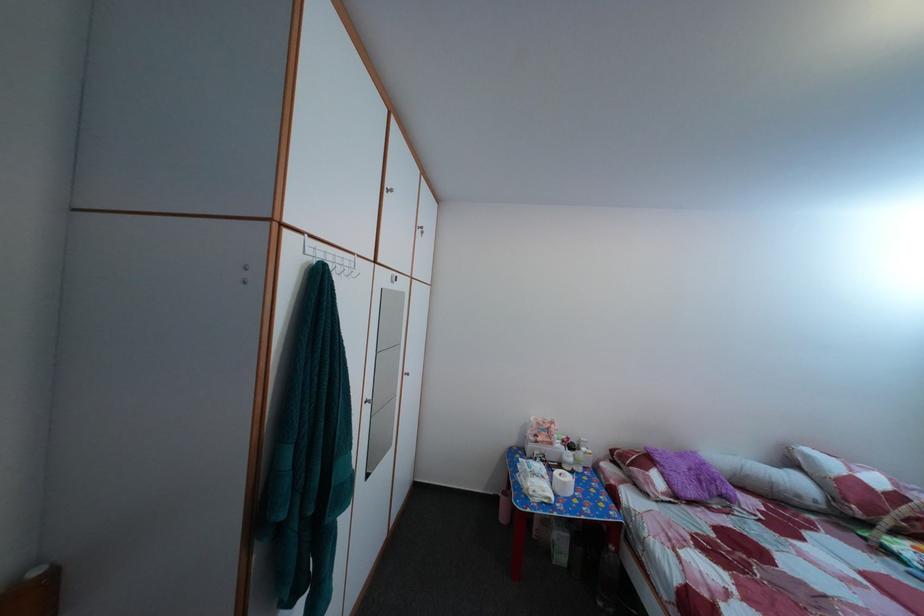
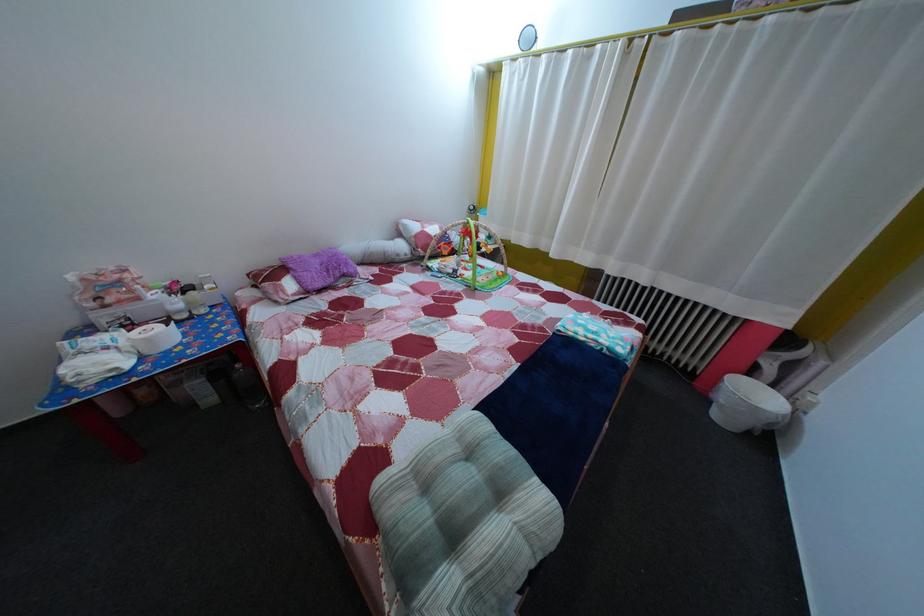
The point at (622,554) is marked in the first image. Where is the corresponding point in the second image?

(248, 374)